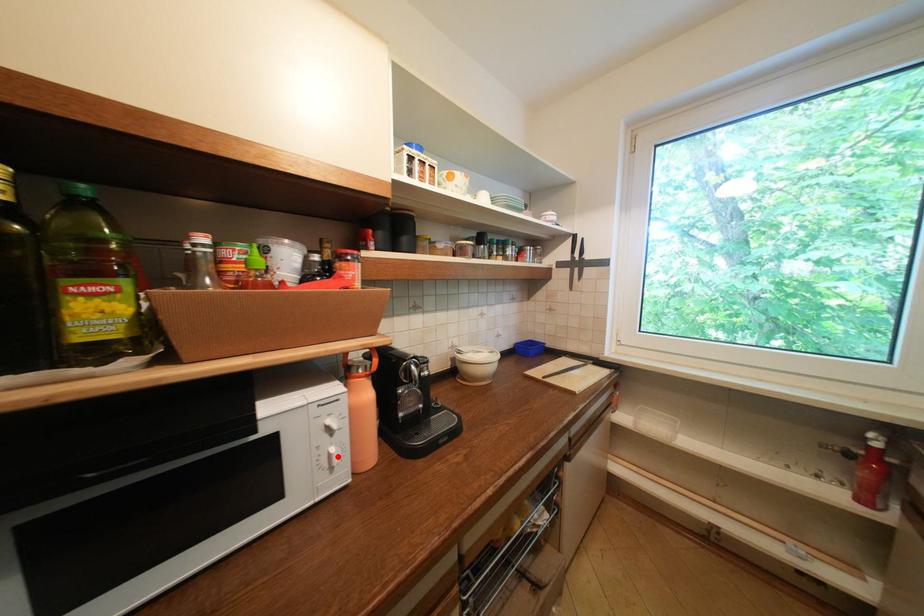
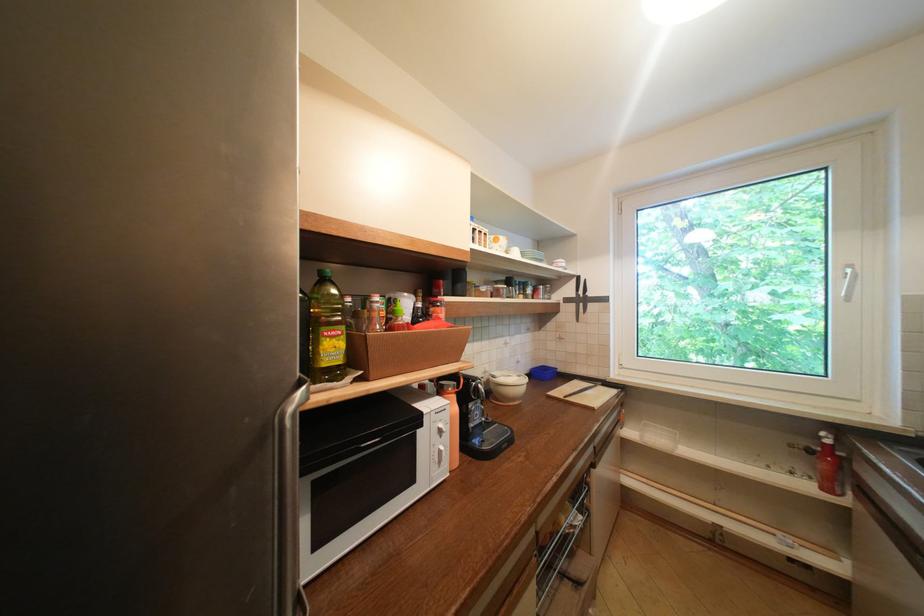
Question: I am providing you with two images of the same scene from different viewpoints. A red point is marked on the first image. Can you still see the location of the red point in image 2?

Choices:
 (A) Yes
 (B) No

Answer: (A)